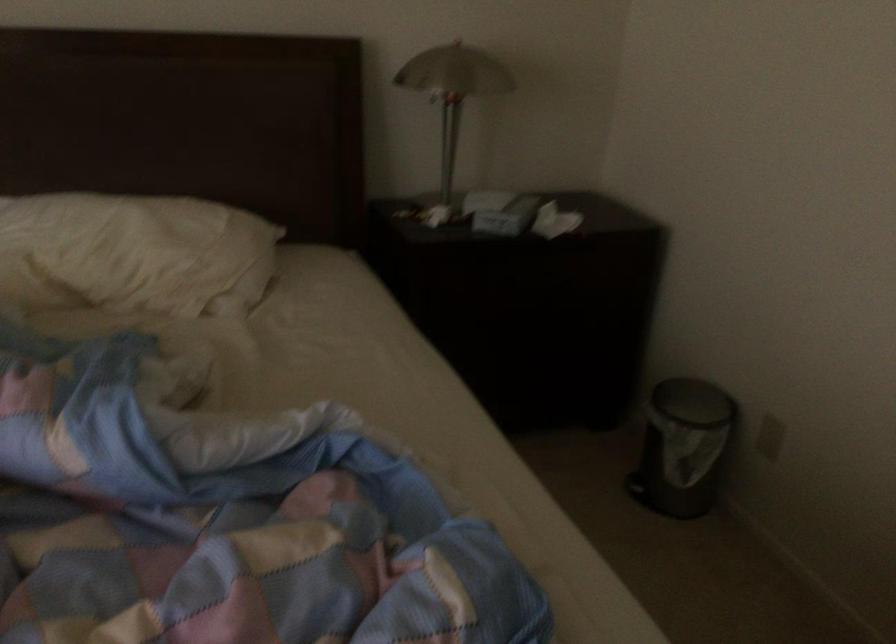
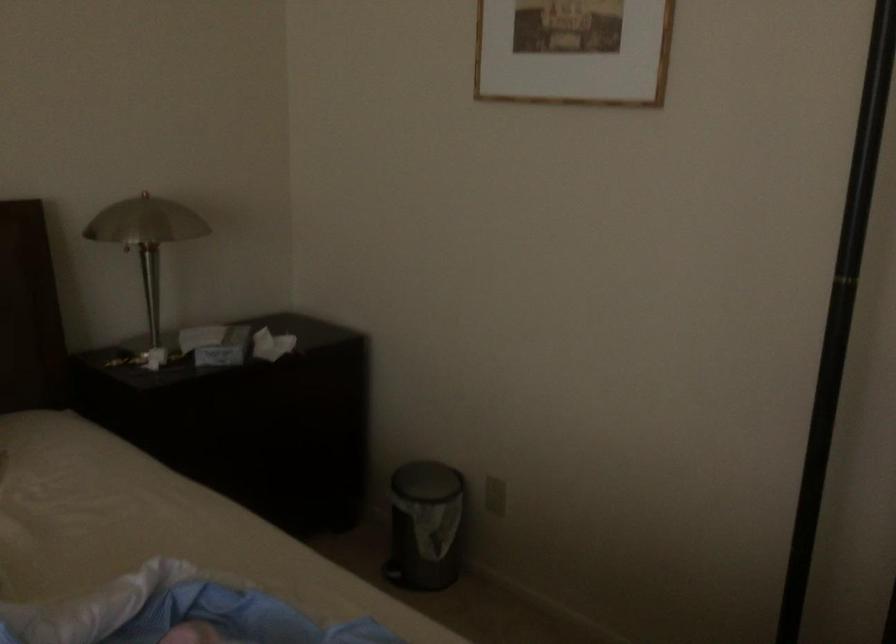
The point at (432,214) is marked in the first image. Where is the corresponding point in the second image?

(151, 357)